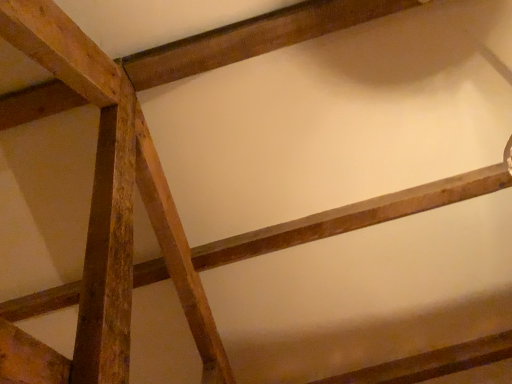
What do you see at coordinates (252, 38) in the screenshot? This screenshot has width=512, height=384. I see `smooth wooden plank at upper center` at bounding box center [252, 38].

The image size is (512, 384). I want to click on smooth wooden plank at upper center, so click(x=252, y=38).

What are the coordinates of `smooth wooden plank at upper center` in the screenshot? It's located at (252, 38).